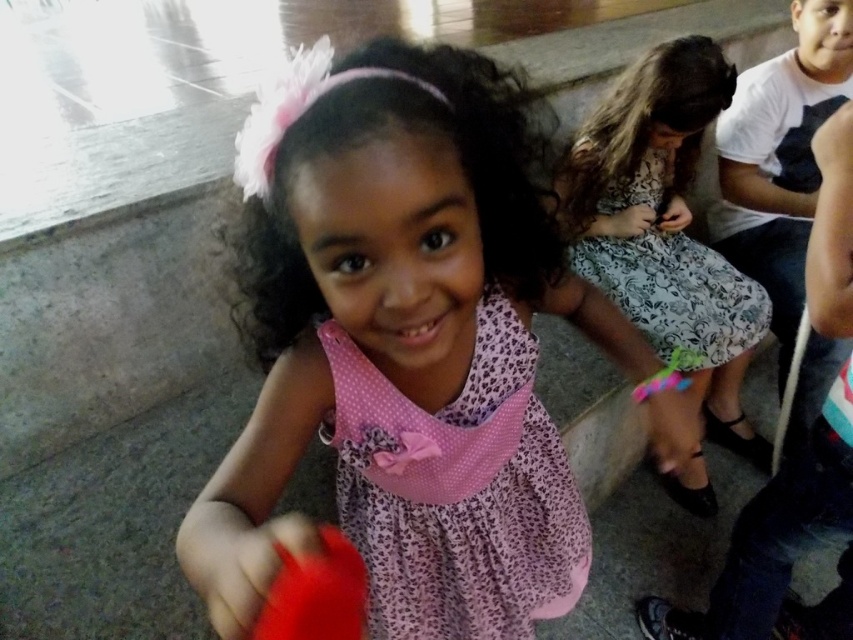
Can you confirm if floral-patterned fabric dress at center is shorter than rubberized plastic toy at lower left?

In fact, floral-patterned fabric dress at center may be taller than rubberized plastic toy at lower left.

This screenshot has height=640, width=853. What do you see at coordinates (676, 291) in the screenshot? I see `floral-patterned fabric dress at center` at bounding box center [676, 291].

Locate an element on the screen. The height and width of the screenshot is (640, 853). floral-patterned fabric dress at center is located at coordinates (676, 291).

Is floral-patterned dress at center positioned before floral-patterned fabric dress at center?

Yes, it is in front of floral-patterned fabric dress at center.

Who is lower down, floral-patterned dress at center or floral-patterned fabric dress at center?

floral-patterned dress at center is lower down.

What are the coordinates of `floral-patterned dress at center` in the screenshot? It's located at (665, 227).

Who is shorter, pink dotted dress at center or rubberized plastic toy at lower left?

rubberized plastic toy at lower left is shorter.

The image size is (853, 640). What do you see at coordinates (401, 348) in the screenshot? I see `pink dotted dress at center` at bounding box center [401, 348].

Who is more forward, (375, 268) or (326, 634)?

Positioned in front is point (326, 634).

The height and width of the screenshot is (640, 853). I want to click on pink dotted dress at center, so click(401, 348).